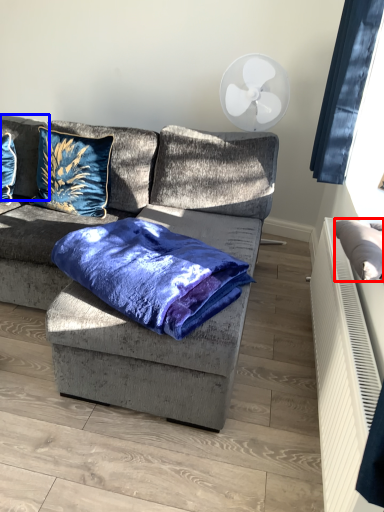
Question: Which of the following is the closest to the observer, pillow (highlighted by a red box) or pillow (highlighted by a blue box)?

Choices:
 (A) pillow
 (B) pillow

Answer: (A)